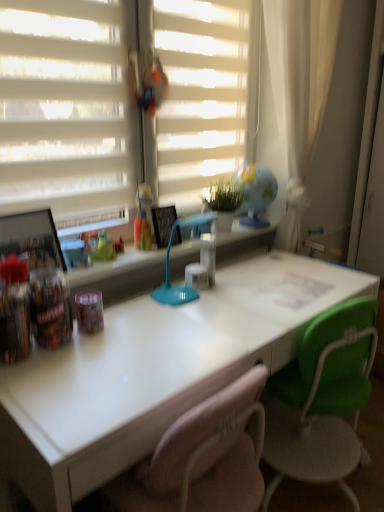
This screenshot has height=512, width=384. What are the coordinates of `blue plastic table lamp at center` in the screenshot? It's located at (169, 265).

The image size is (384, 512). Describe the element at coordinates (143, 219) in the screenshot. I see `translucent plastic cup at upper center` at that location.

Find the location of a particular element. green fabric chair at center is located at coordinates (322, 399).

Where is `white matte blinds at upper center`? white matte blinds at upper center is located at coordinates (200, 94).

Measure the distance between point [34,136] and camera.

The depth of point [34,136] is 1.38 meters.

The height and width of the screenshot is (512, 384). I want to click on white matte shutter at upper left, so click(64, 106).

Find the location of a particular element. The width and height of the screenshot is (384, 512). blue plastic table lamp at center is located at coordinates (169, 265).

From the image's perspective, between translucent plastic cup at upper center and green fabric chair at center, who is located below?

green fabric chair at center.

What's the angular difference between translucent plastic cup at upper center and green fabric chair at center's facing directions?

180 degrees.

In the scene shown: Is green fabric chair at center surrounded by translucent plastic cup at upper center?

Actually, green fabric chair at center is outside translucent plastic cup at upper center.

Which of these two, translucent plastic cup at upper center or green fabric chair at center, is thinner?

translucent plastic cup at upper center is thinner.

How different are the orientations of white matte shutter at upper left and white glossy desk at center in degrees?

The angle between the facing direction of white matte shutter at upper left and the facing direction of white glossy desk at center is 0.939 degrees.

Are white matte shutter at upper left and white glossy desk at center far apart?

No, white matte shutter at upper left is not far from white glossy desk at center.

Which of these two, white matte shutter at upper left or white glossy desk at center, is thinner?

Thinner between the two is white matte shutter at upper left.

Is white matte shutter at upper left positioned beyond the bounds of white glossy desk at center?

Yes.

How different are the orientations of white glossy desk at center and white matte shutter at upper left in degrees?

There is a 0.939-degree angle between the facing directions of white glossy desk at center and white matte shutter at upper left.

Is white matte shutter at upper left a part of white glossy desk at center?

No.

Can you confirm if white glossy desk at center is smaller than white matte shutter at upper left?

No.

Locate an element on the screen. The image size is (384, 512). desk in front of the white matte shutter at upper left is located at coordinates (153, 371).

The height and width of the screenshot is (512, 384). What are the coordinates of `chair lying on the right of white glossy desk at center` in the screenshot? It's located at (322, 399).

In terms of width, does white glossy desk at center look wider or thinner when compared to green fabric chair at center?

white glossy desk at center is thinner than green fabric chair at center.

Is white glossy desk at center facing away from green fabric chair at center?

Yes, white glossy desk at center is positioned with its back facing green fabric chair at center.

Between white glossy desk at center and green fabric chair at center, which one is positioned in front?

white glossy desk at center is closer to the camera.

The image size is (384, 512). Identify the location of chair below the blue plastic table lamp at center (from a real-world perspective). [322, 399].

Is blue plastic table lamp at center facing away from green fabric chair at center?

No.

Between blue plastic table lamp at center and green fabric chair at center, which one appears on the left side from the viewer's perspective?

blue plastic table lamp at center.

Consider the image. From a real-world perspective, which is physically above, blue plastic table lamp at center or green fabric chair at center?

blue plastic table lamp at center, from a real-world perspective.

Considering the relative positions of white matte blinds at upper center and translucent plastic cup at upper center in the image provided, is white matte blinds at upper center to the right of translucent plastic cup at upper center from the viewer's perspective?

Yes, white matte blinds at upper center is to the right of translucent plastic cup at upper center.

Is point (155, 18) more distant than point (151, 246)?

No.

From the picture: Can you tell me how much white matte blinds at upper center and translucent plastic cup at upper center differ in facing direction?

The facing directions of white matte blinds at upper center and translucent plastic cup at upper center are 0.481 degrees apart.

Is translucent plastic cup at upper center positioned before white matte shutter at upper left?

No, translucent plastic cup at upper center is further to the viewer.

Considering the sizes of translucent plastic cup at upper center and white matte shutter at upper left in the image, is translucent plastic cup at upper center wider or thinner than white matte shutter at upper left?

Considering their sizes, translucent plastic cup at upper center looks broader than white matte shutter at upper left.

Is translucent plastic cup at upper center positioned with its back to white matte shutter at upper left?

Yes, translucent plastic cup at upper center's orientation is away from white matte shutter at upper left.

In terms of size, does translucent plastic cup at upper center appear bigger or smaller than white matte shutter at upper left?

In the image, translucent plastic cup at upper center appears to be smaller than white matte shutter at upper left.

Find the location of a particular element. The width and height of the screenshot is (384, 512). toy that appears on the left of green fabric chair at center is located at coordinates (143, 219).

What are the coordinates of `desk on the right of white matte shutter at upper left` in the screenshot? It's located at (153, 371).

Estimate the real-world distances between objects in this image. Which object is further from white glossy desk at center, white matte blinds at upper center or white matte shutter at upper left?

white matte blinds at upper center.

When comparing their distances from white matte shutter at upper left, does white glossy desk at center or translucent plastic cup at upper center seem closer?

translucent plastic cup at upper center.

From the image, which object appears to be farther from blue plastic table lamp at center, white matte shutter at upper left or white glossy desk at center?

Based on the image, white matte shutter at upper left appears to be further to blue plastic table lamp at center.

Which object lies further to the anchor point white glossy desk at center, green fabric chair at center or blue plastic table lamp at center?

The object further to white glossy desk at center is green fabric chair at center.

Which object lies further to the anchor point white matte shutter at upper left, green fabric chair at center or white matte blinds at upper center?

green fabric chair at center is further to white matte shutter at upper left.

Based on their spatial positions, is blue plastic table lamp at center or green fabric chair at center closer to white matte shutter at upper left?

Based on the image, blue plastic table lamp at center appears to be nearer to white matte shutter at upper left.

When comparing their distances from white matte blinds at upper center, does green fabric chair at center or blue plastic table lamp at center seem further?

Among the two, green fabric chair at center is located further to white matte blinds at upper center.

Which object lies further to the anchor point white matte shutter at upper left, green fabric chair at center or white glossy desk at center?

green fabric chair at center is further to white matte shutter at upper left.

Find the location of `table lamp between white matte blinds at upper center and white glossy desk at center in the vertical direction`. table lamp between white matte blinds at upper center and white glossy desk at center in the vertical direction is located at coordinates coord(169,265).

Locate an element on the screen. chair between white matte blinds at upper center and white glossy desk at center vertically is located at coordinates (322, 399).

I want to click on chair between blue plastic table lamp at center and white glossy desk at center in the up-down direction, so click(322, 399).

Find the location of `toy located between white matte shutter at upper left and white matte blinds at upper center in the left-right direction`. toy located between white matte shutter at upper left and white matte blinds at upper center in the left-right direction is located at coordinates (143, 219).